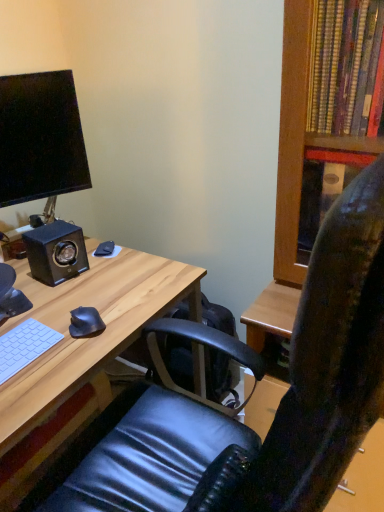
Find the location of `free spot to the right of black matte speaker at left`. free spot to the right of black matte speaker at left is located at coordinates (112, 272).